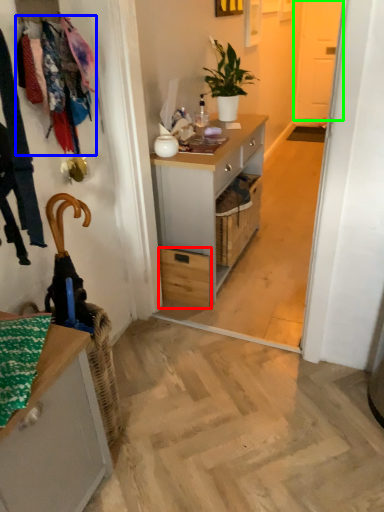
Question: Considering the real-world distances, which object is closest to drawer (highlighted by a red box)? clothesline (highlighted by a blue box) or screen door (highlighted by a green box).

Choices:
 (A) clothesline
 (B) screen door

Answer: (A)